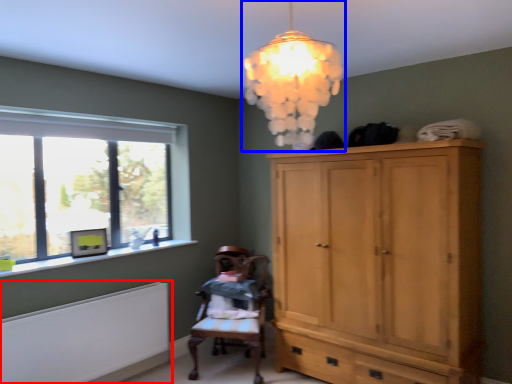
Question: Among these objects, which one is nearest to the camera, radiator (highlighted by a red box) or lamp (highlighted by a blue box)?

Choices:
 (A) radiator
 (B) lamp

Answer: (B)